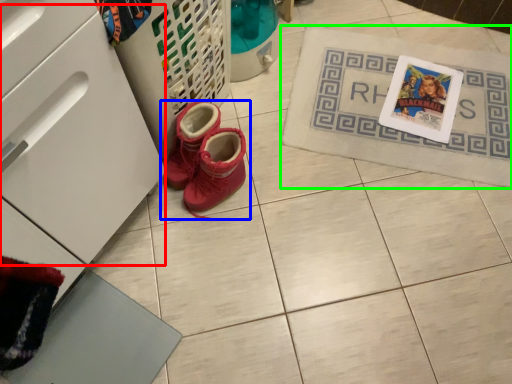
Question: Considering the real-world distances, which object is farthest from drawer (highlighted by a red box)? footwear (highlighted by a blue box) or bath mat (highlighted by a green box)?

Choices:
 (A) footwear
 (B) bath mat

Answer: (B)